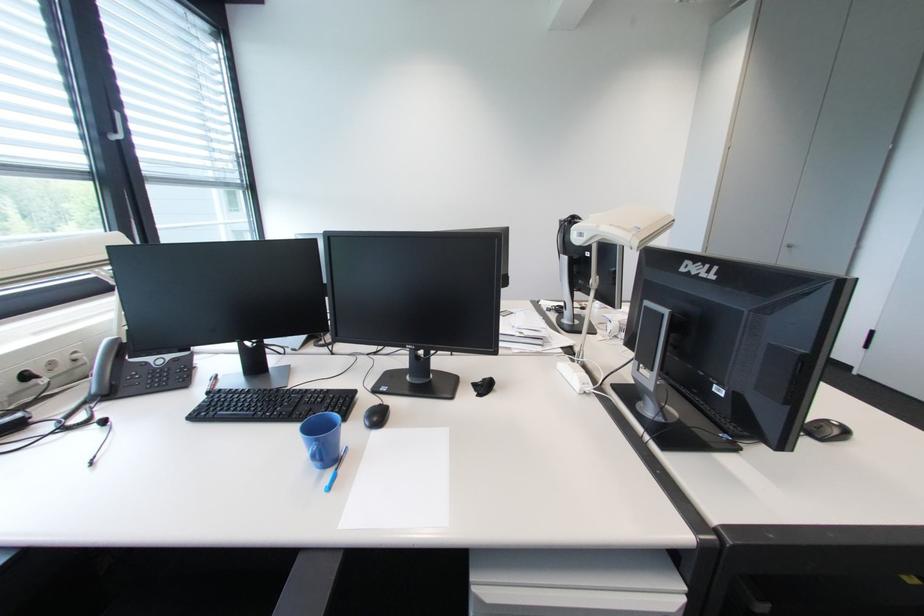
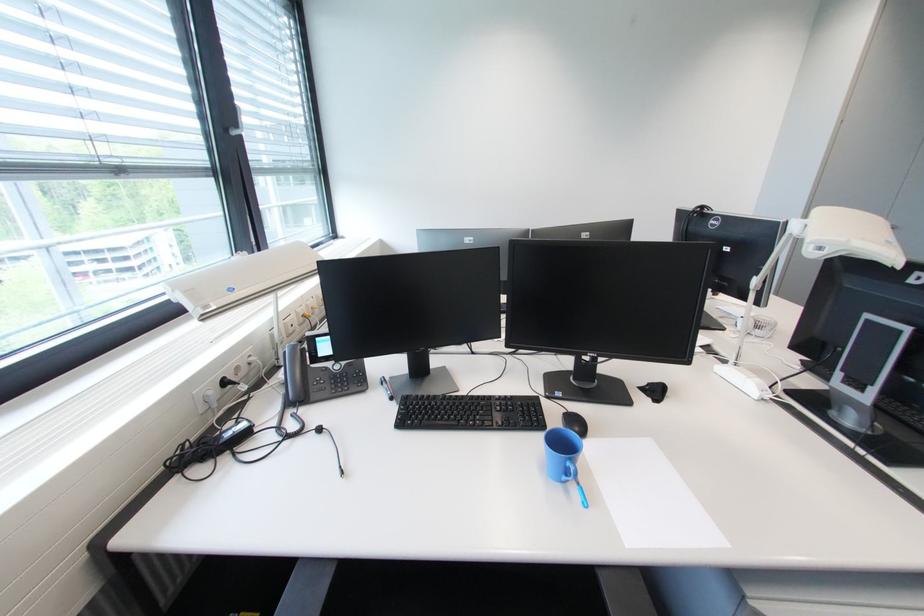
In the second image, find the point that corresponds to [387,406] in the first image.

(573, 411)